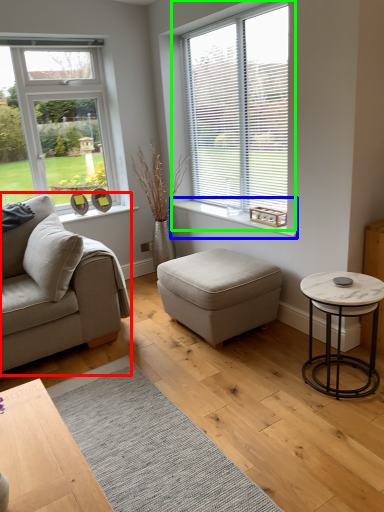
Question: Which object is the farthest from studio couch (highlighted by a red box)? Choose among these: window sill (highlighted by a blue box) or window (highlighted by a green box).

Choices:
 (A) window sill
 (B) window

Answer: (B)